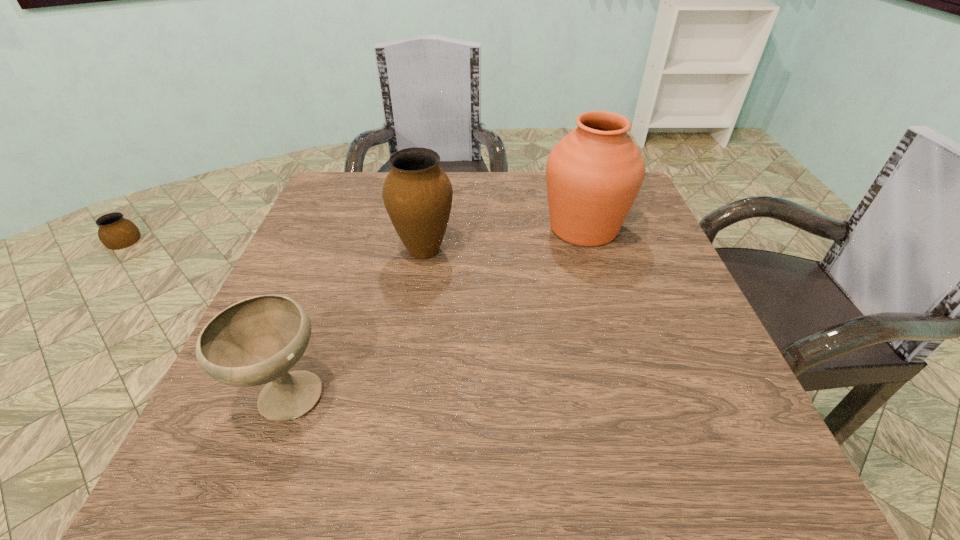
Identify the location of object present at the near edge. (256, 341).

You are a GUI agent. You are given a task and a screenshot of the screen. Output one action in this format:
    pyautogui.click(x=<x>, y=<y>)
    Task: Click on the object present at the left edge
    The height and width of the screenshot is (540, 960).
    Given the screenshot: What is the action you would take?
    pyautogui.click(x=256, y=341)

This screenshot has width=960, height=540. Identify the location of object located in the right edge section of the desktop. (595, 172).

Image resolution: width=960 pixels, height=540 pixels. I want to click on object that is at the near left corner, so click(256, 341).

Find the location of a particular element. object located at the far right corner is located at coordinates (595, 172).

Locate an element on the screen. The image size is (960, 540). vacant space at the far edge of the desktop is located at coordinates tap(506, 208).

Locate an element on the screen. This screenshot has width=960, height=540. vacant space at the near edge of the desktop is located at coordinates (346, 472).

Find the location of a particular element. vacant space at the left edge of the desktop is located at coordinates (308, 225).

What are the coordinates of `free space at the right edge of the desktop` in the screenshot? It's located at (747, 433).

Identify the location of vacant space at the far left corner. (339, 207).